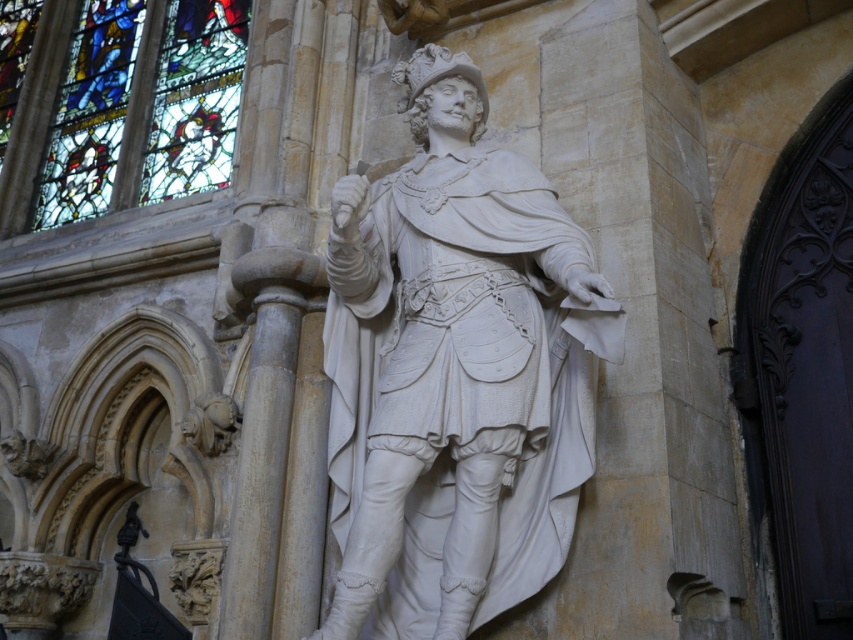
Question: In this image, where is white marble statue at center located relative to stained glass window at upper left?

Choices:
 (A) below
 (B) above

Answer: (A)

Question: Which object appears closest to the camera in this image?

Choices:
 (A) white marble statue at center
 (B) stained glass window at upper left

Answer: (A)

Question: Can you confirm if white marble statue at center is positioned below stained glass window at upper left?

Choices:
 (A) yes
 (B) no

Answer: (A)

Question: Which object appears closest to the camera in this image?

Choices:
 (A) white marble statue at center
 (B) stained glass window at upper left

Answer: (A)

Question: Does white marble statue at center have a lesser width compared to stained glass window at upper left?

Choices:
 (A) no
 (B) yes

Answer: (B)